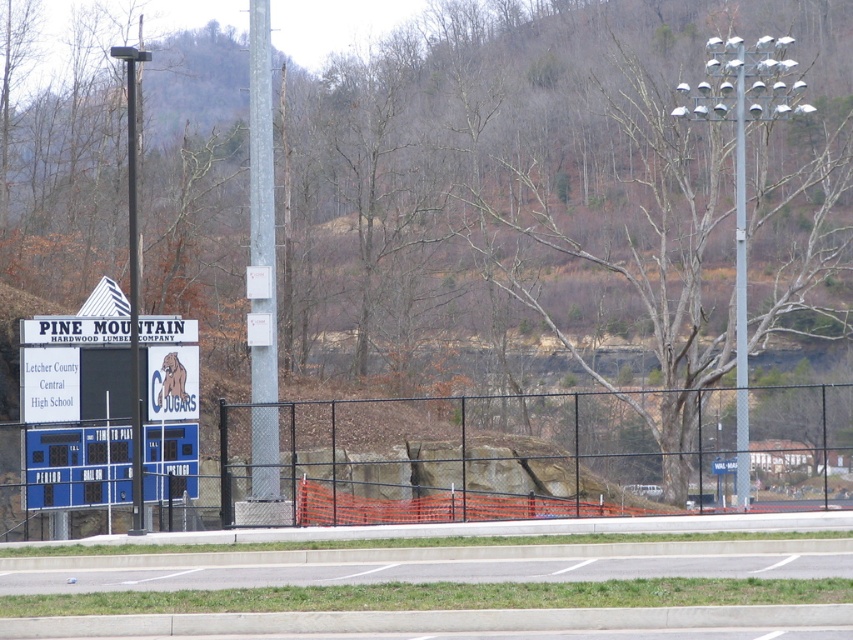
Question: Considering the real-world distances, which object is farthest from the metallic pole at left?

Choices:
 (A) metallic gray pole at upper right
 (B) metallic gray pole at center
 (C) black chain-link fence at center

Answer: (A)

Question: Does metallic gray pole at upper right have a lesser width compared to metallic pole at left?

Choices:
 (A) no
 (B) yes

Answer: (B)

Question: Among these objects, which one is nearest to the camera?

Choices:
 (A) metallic pole at left
 (B) black chain-link fence at center
 (C) metallic gray pole at upper right

Answer: (A)

Question: Does blue glossy scoreboard at left have a smaller size compared to metallic pole at left?

Choices:
 (A) no
 (B) yes

Answer: (B)

Question: Does black chain-link fence at center appear on the right side of blue glossy scoreboard at left?

Choices:
 (A) yes
 (B) no

Answer: (A)

Question: Which object is farther from the camera taking this photo?

Choices:
 (A) metallic pole at left
 (B) metallic gray pole at center
 (C) metallic gray pole at upper right

Answer: (B)